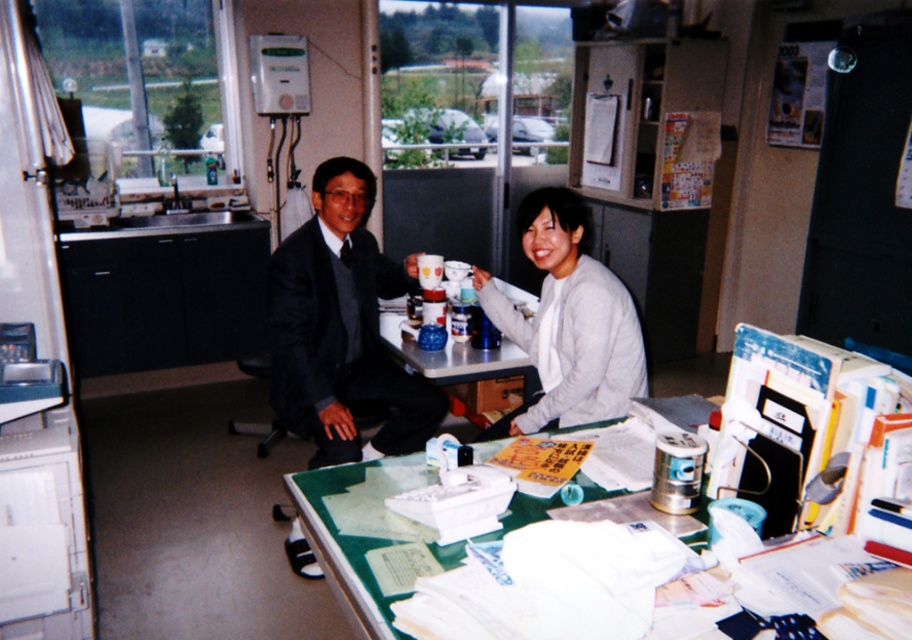
You are organizing a formal event and need to ensure that the matte black suit at center is visible to all attendees. Since the green glass table at center is part of the event setup, how should you arrange them to maintain visibility of the suit?

The matte black suit at center is positioned over the green glass table at center, so placing it directly on top ensures it remains visible without being obscured by the table.

You are standing in the office and want to place a new item on the closest object to you between the matte black suit at center and the green glass table at center. Which object should you choose?

The matte black suit at center is closer to you than the green glass table at center, so you should place the new item on the matte black suit at center.

You are standing in the office and want to place a new plant pot on the table. The plant pot is taller than the dark gray suit at center. Will the plant pot fit on the green glass table at center?

The dark gray suit at center is taller than the green glass table at center. Since the plant pot is taller than the dark gray suit at center, it will also be taller than the table, so the plant pot will not fit on the green glass table at center.